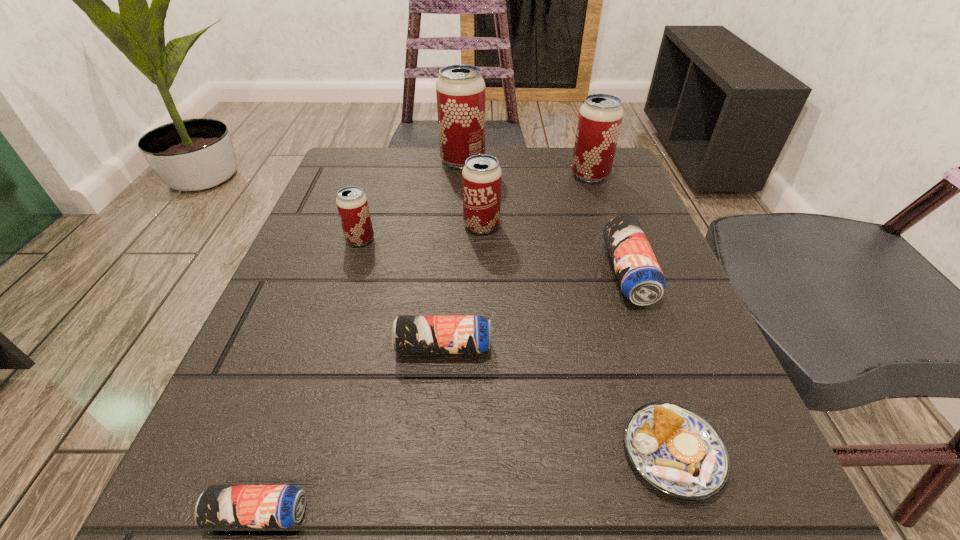
This screenshot has height=540, width=960. I want to click on the tallest beer can, so click(460, 89).

The height and width of the screenshot is (540, 960). Find the location of `the biggest red beer can`. the biggest red beer can is located at coordinates (460, 89).

This screenshot has width=960, height=540. Find the location of `the rightmost red beer can`. the rightmost red beer can is located at coordinates (600, 117).

Identify the location of the second biggest red beer can. This screenshot has width=960, height=540. (600, 117).

Identify the location of the second smallest red beer can. (481, 177).

What are the coordinates of `the sixth shortest object` in the screenshot? It's located at (481, 177).

Where is `the leftmost red beer can`? The image size is (960, 540). the leftmost red beer can is located at coordinates (352, 204).

Locate an element on the screen. Image resolution: width=960 pixels, height=540 pixels. the fourth shortest beer can is located at coordinates (352, 204).

Identify the location of the biggest blue beer can. (641, 280).

In order to click on the farthest blue beer can in this screenshot , I will do `click(641, 280)`.